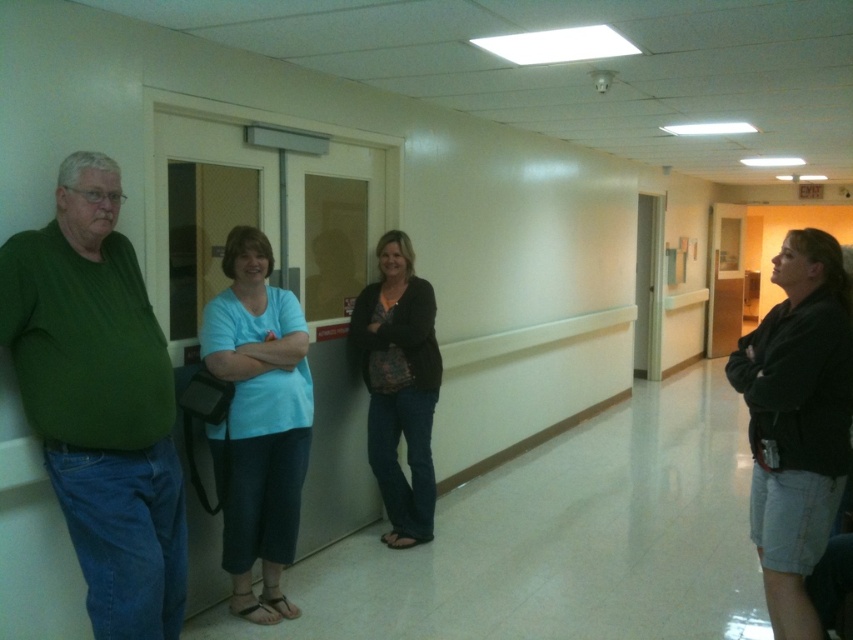
Is green matte sweater at left above light blue t-shirt at center?

Indeed, green matte sweater at left is positioned over light blue t-shirt at center.

Consider the image. Can you confirm if green matte sweater at left is positioned to the right of light blue t-shirt at center?

No, green matte sweater at left is not to the right of light blue t-shirt at center.

Is point (33, 401) closer to viewer compared to point (270, 333)?

Yes, it is.

Identify the location of green matte sweater at left. click(99, 401).

Is point (256, 468) positioned after point (403, 314)?

No, it is not.

The image size is (853, 640). What do you see at coordinates (258, 420) in the screenshot? I see `light blue t-shirt at center` at bounding box center [258, 420].

Is point (250, 337) behind point (412, 545)?

No, it is not.

This screenshot has width=853, height=640. In order to click on light blue t-shirt at center in this screenshot , I will do `click(258, 420)`.

Measure the distance between green matte sweater at left and black matte sweater at center.

They are 1.70 meters apart.

Which is behind, point (107, 468) or point (368, 348)?

The point (368, 348) is behind.

I want to click on green matte sweater at left, so click(x=99, y=401).